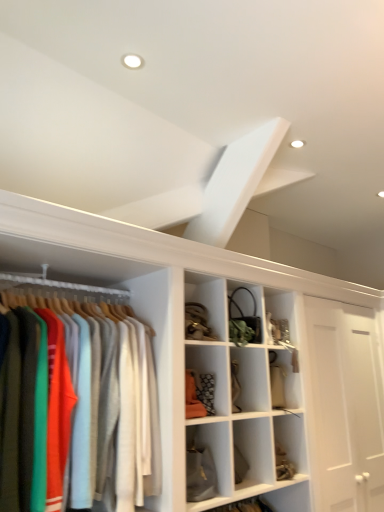
Question: Considering the relative sizes of matte cotton shirts at left and white matte exhaust hood at upper center in the image provided, is matte cotton shirts at left bigger than white matte exhaust hood at upper center?

Choices:
 (A) no
 (B) yes

Answer: (B)

Question: Are matte cotton shirts at left and white matte exhaust hood at upper center located far from each other?

Choices:
 (A) no
 (B) yes

Answer: (B)

Question: Does matte cotton shirts at left have a lesser width compared to white matte exhaust hood at upper center?

Choices:
 (A) yes
 (B) no

Answer: (B)

Question: Does matte cotton shirts at left touch white matte exhaust hood at upper center?

Choices:
 (A) no
 (B) yes

Answer: (A)

Question: Is matte cotton shirts at left behind white matte exhaust hood at upper center?

Choices:
 (A) no
 (B) yes

Answer: (A)

Question: From the image's perspective, would you say matte cotton shirts at left is positioned over white matte exhaust hood at upper center?

Choices:
 (A) no
 (B) yes

Answer: (A)

Question: Are white matte exhaust hood at upper center and matte cotton shirts at left located far from each other?

Choices:
 (A) no
 (B) yes

Answer: (B)

Question: Could you tell me if white matte exhaust hood at upper center is turned towards matte cotton shirts at left?

Choices:
 (A) no
 (B) yes

Answer: (A)

Question: From the image's perspective, would you say white matte exhaust hood at upper center is positioned over matte cotton shirts at left?

Choices:
 (A) yes
 (B) no

Answer: (A)

Question: Is the position of white matte exhaust hood at upper center less distant than that of matte cotton shirts at left?

Choices:
 (A) no
 (B) yes

Answer: (A)

Question: Can you confirm if white matte exhaust hood at upper center is positioned to the left of matte cotton shirts at left?

Choices:
 (A) yes
 (B) no

Answer: (B)

Question: Does white matte exhaust hood at upper center have a smaller size compared to matte cotton shirts at left?

Choices:
 (A) no
 (B) yes

Answer: (B)

Question: From the image's perspective, is white matte exhaust hood at upper center located above or below matte cotton shirts at left?

Choices:
 (A) above
 (B) below

Answer: (A)